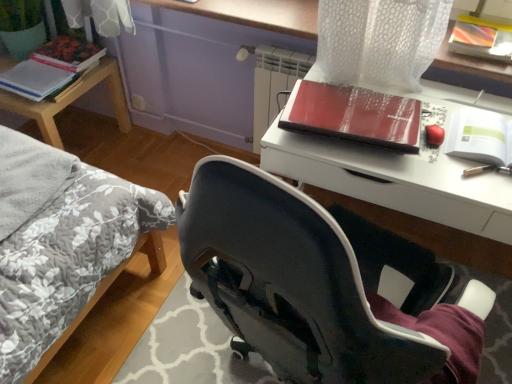
The width and height of the screenshot is (512, 384). In order to click on free space above matte hardcover book at upper left, the 2th paperback book when ordered from left to right (from a real-world perspective) in this screenshot , I will do `click(68, 52)`.